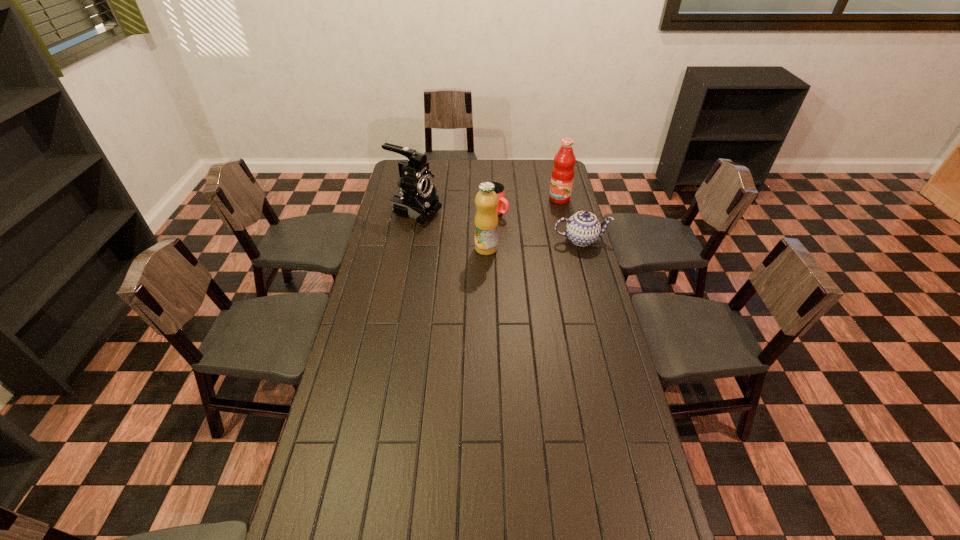
Where is `vacant spot on the desktop that is between the left fruit juice and the chinaware and is positioned on the lens mount of the camcorder`? The height and width of the screenshot is (540, 960). vacant spot on the desktop that is between the left fruit juice and the chinaware and is positioned on the lens mount of the camcorder is located at coordinates coord(524,245).

You are a GUI agent. You are given a task and a screenshot of the screen. Output one action in this format:
    pyautogui.click(x=<x>, y=<y>)
    Task: Click on the vacant space on the desktop that is between the left fruit juice and the chinaware and is positioned on the front label of the farther fruit juice
    The width and height of the screenshot is (960, 540).
    Given the screenshot: What is the action you would take?
    pyautogui.click(x=520, y=245)

Find the location of a particular element. vacant space on the desktop that is between the nearer fruit juice and the chinaware and is positioned on the handle side of the cup is located at coordinates (547, 243).